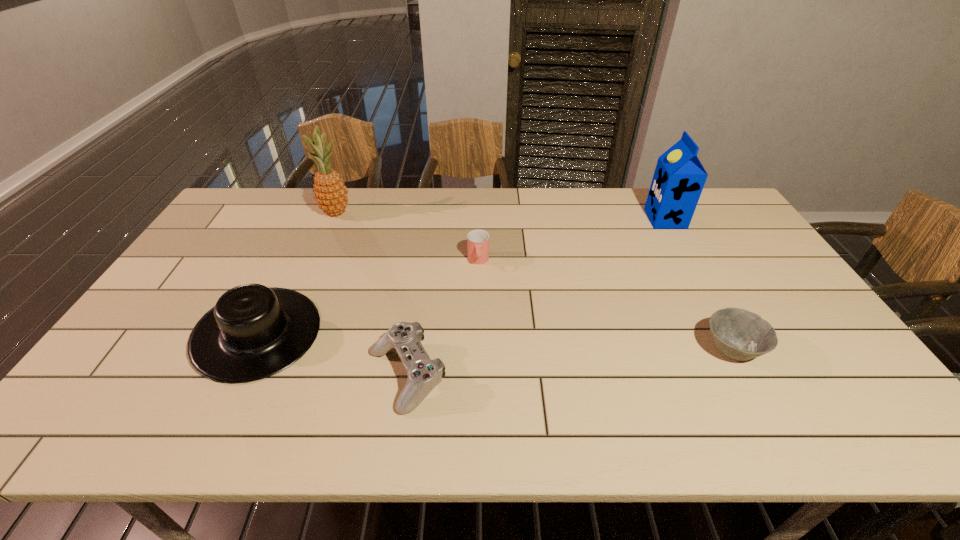
Identify the location of pineapple. Image resolution: width=960 pixels, height=540 pixels. (330, 192).

What are the coordinates of `carton` in the screenshot? It's located at pyautogui.click(x=679, y=177).

You are a GUI agent. You are given a task and a screenshot of the screen. Output one action in this format:
    pyautogui.click(x=<x>, y=<y>)
    Task: Click on the third tallest object
    The width and height of the screenshot is (960, 540).
    Given the screenshot: What is the action you would take?
    pyautogui.click(x=253, y=332)

At what (x,y) coordinates should I click in order to perform the action: click on the third object from right to left. Please return your answer as a coordinate pair (x, y). This screenshot has height=540, width=960. Looking at the image, I should click on (478, 240).

The image size is (960, 540). I want to click on cup, so click(478, 240).

At what (x,y) coordinates should I click in order to perform the action: click on bowl. Please return your answer as a coordinate pair (x, y). Looking at the image, I should click on (739, 334).

In order to click on the fourth object from right to left in this screenshot , I will do `click(424, 374)`.

Identify the location of blank space located 0.320m on the front of the pineapple. The image size is (960, 540). (304, 285).

Where is `vacant space located 0.360m with the cap open on the carton`? vacant space located 0.360m with the cap open on the carton is located at coordinates (545, 219).

The width and height of the screenshot is (960, 540). Find the location of `vacant region located with the cap open on the carton`. vacant region located with the cap open on the carton is located at coordinates (600, 219).